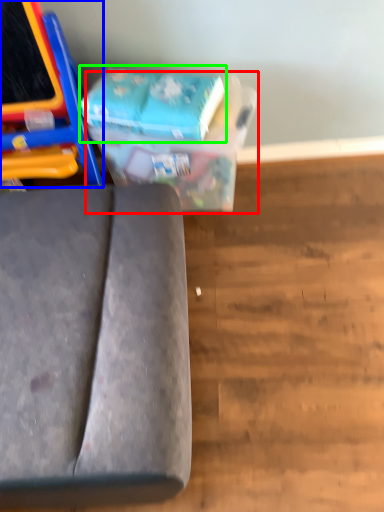
Question: Which object is positioned farthest from cardboard box (highlighted by a red box)? Select from furniture (highlighted by a blue box) and paperback book (highlighted by a green box).

Choices:
 (A) furniture
 (B) paperback book

Answer: (A)